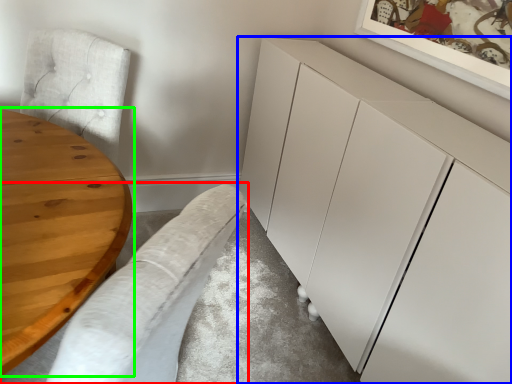
Question: Which object is positioned closest to couch (highlighted by a red box)? Select from cabinetry (highlighted by a blue box) and table (highlighted by a green box).

Choices:
 (A) cabinetry
 (B) table

Answer: (B)